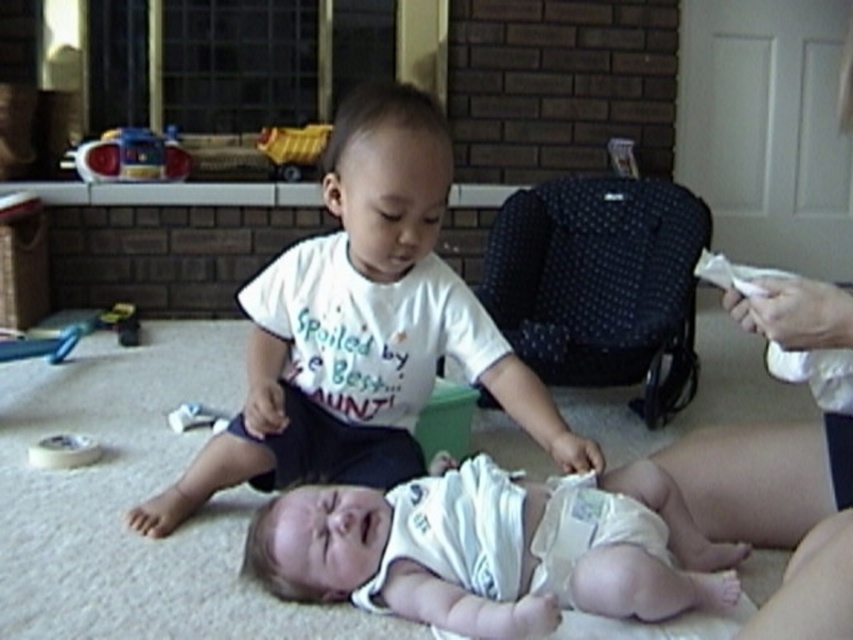
In the living room scene, there is a translucent plastic toy at upper left and a white matte tape at lower left. Which object is positioned to the left of the other?

The translucent plastic toy at upper left is positioned to the left of the white matte tape at lower left.

Consider the image. You are a parent trying to change your baby. You have a white cloth diaper at lower center and a white matte tape at lower left. Which item is taller?

The white cloth diaper at lower center is taller than the white matte tape at lower left.